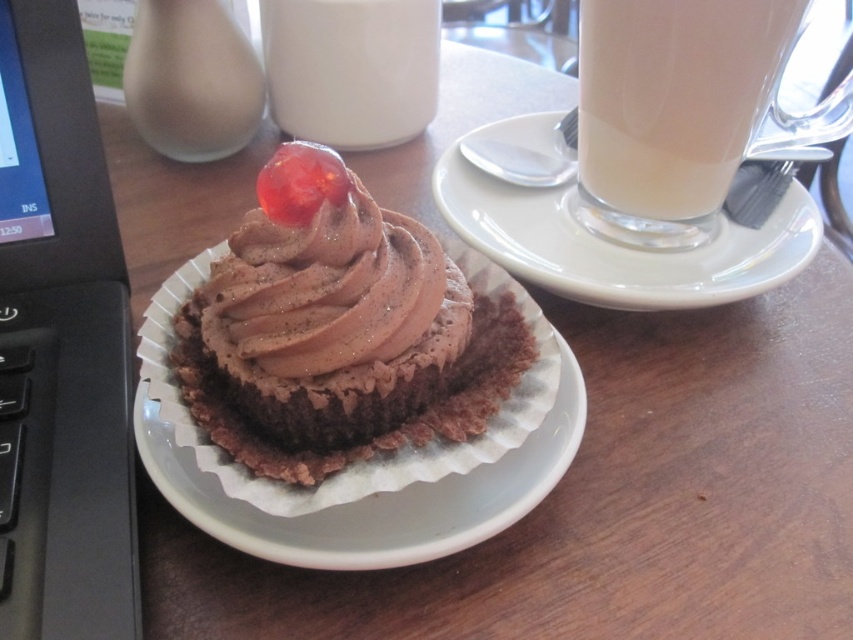
You need to place a 30 cm wide laptop bag on the desk between the black plastic laptop at left and the camera. Is there enough space?

The distance between the black plastic laptop at left and the camera is 33.75 centimeters, so yes, the 30 cm wide laptop bag can fit in the space between them since it is narrower than the available space.

You are setting up a dessert table and need to stack two plates vertically. The white paper plate at center and the white paper plate at upper right are available. Which plate should you choose to place at the bottom to ensure stability?

The white paper plate at upper right should be placed at the bottom because it has a greater height than the white paper plate at center, providing a more stable base.